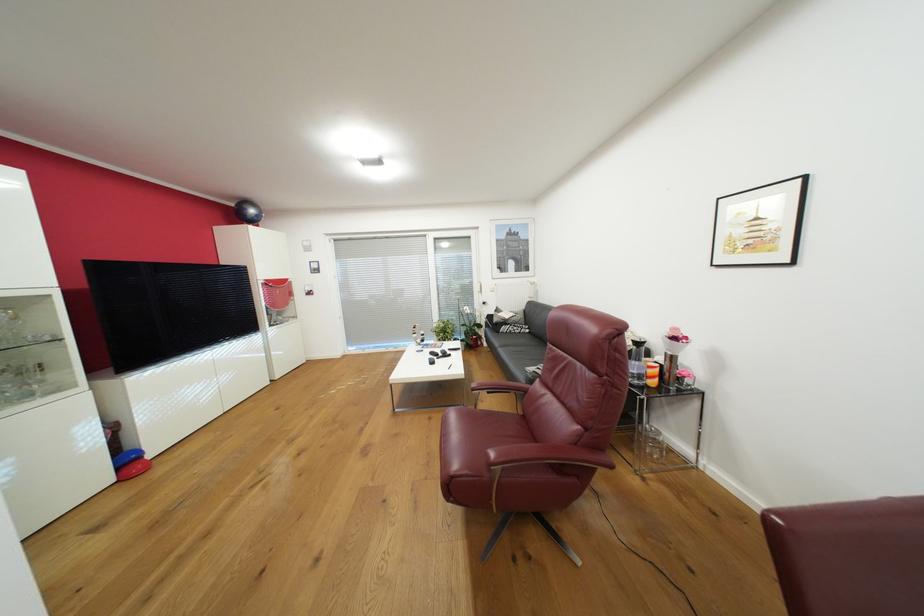
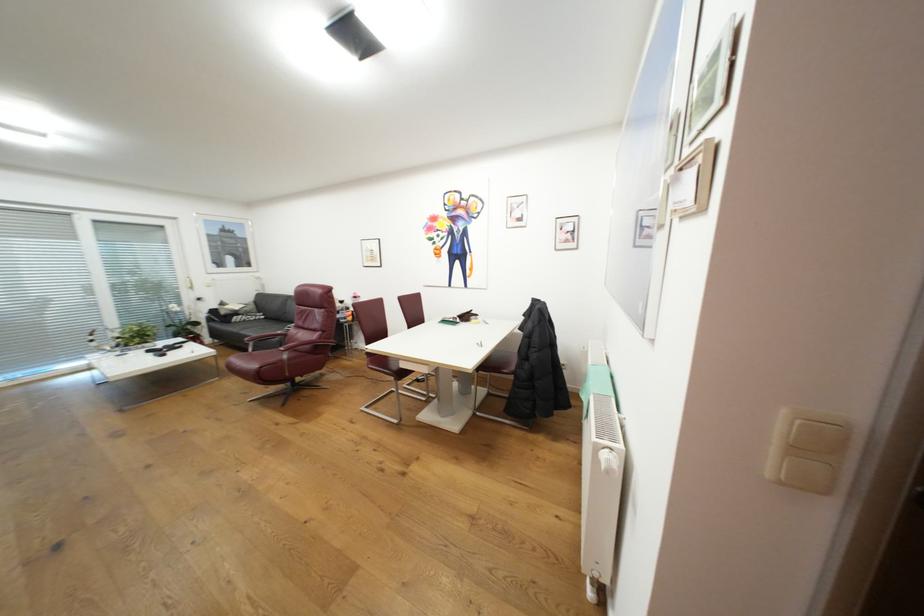
Where in the second image is the point corresponding to (x=459, y=477) from the first image?

(268, 368)